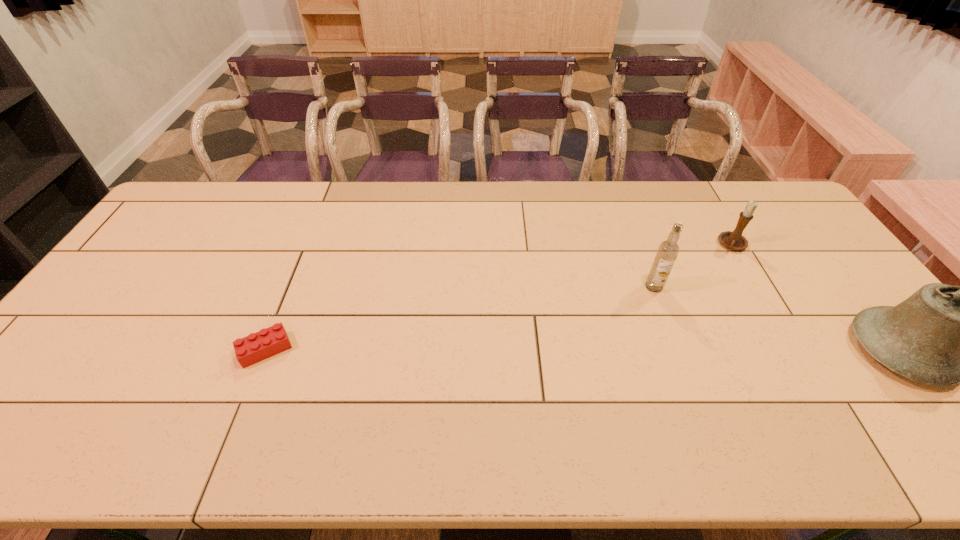
Where is `vacant space on the desktop that is between the leftmost object and the bell and is positioned on the label of the second farthest object`? The image size is (960, 540). vacant space on the desktop that is between the leftmost object and the bell and is positioned on the label of the second farthest object is located at coordinates (609, 350).

Find the location of `vacant spot on the desktop that is between the shortest object and the bell and is positioned on the side of the second shortest object with the handle`. vacant spot on the desktop that is between the shortest object and the bell and is positioned on the side of the second shortest object with the handle is located at coordinates (648, 350).